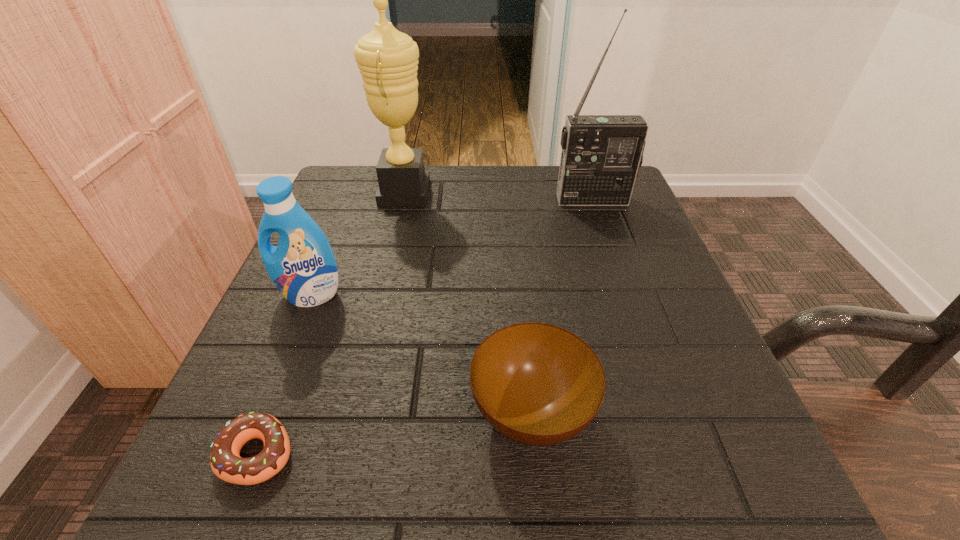
You are a GUI agent. You are given a task and a screenshot of the screen. Output one action in this format:
    pyautogui.click(x=<x>, y=<y>)
    Task: Click on the vacant space situated 0.100m on the right of the bowl
    The image size is (960, 540).
    Given the screenshot: What is the action you would take?
    pyautogui.click(x=665, y=414)

Identify the location of vacant space positioned 0.240m on the back of the shortest object. This screenshot has height=540, width=960. (319, 296).

Where is `trophy cup present at the far edge`? trophy cup present at the far edge is located at coordinates (387, 59).

Where is `radio receiver that is at the far edge`? This screenshot has width=960, height=540. radio receiver that is at the far edge is located at coordinates (601, 154).

Locate an element on the screen. bowl present at the near edge is located at coordinates (537, 384).

Identify the location of doughnut that is at the near edge. The image size is (960, 540). (226, 463).

This screenshot has width=960, height=540. Identify the location of trophy cup situated at the left edge. (387, 59).

Identify the location of detergent present at the left edge. (302, 266).

Image resolution: width=960 pixels, height=540 pixels. I want to click on doughnut that is at the left edge, so click(x=226, y=463).

Find the location of a particular element. The width and height of the screenshot is (960, 540). object that is at the right edge is located at coordinates (601, 154).